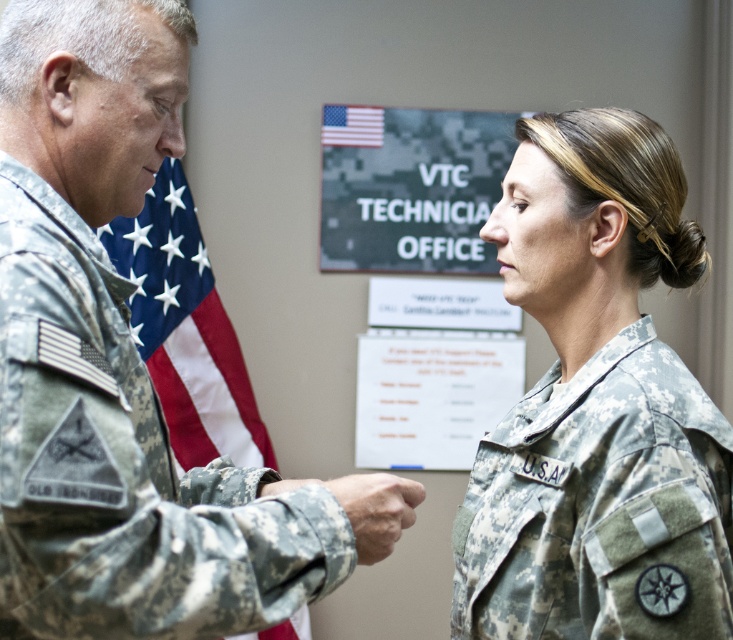
Between point (394, 125) and point (368, 332), which one is positioned in front?

Point (394, 125) is more forward.

Is camouflage fabric signboard at center positioned in front of white paper at center?

Yes, camouflage fabric signboard at center is closer to the viewer.

Who is more distant from viewer, (356, 253) or (408, 372)?

Point (408, 372)

Locate an element on the screen. The image size is (733, 640). camouflage fabric signboard at center is located at coordinates (410, 188).

From the picture: Is camouflage fabric uniform at right above white paper at center?

Indeed, camouflage fabric uniform at right is positioned over white paper at center.

Is the position of camouflage fabric uniform at right more distant than that of white paper at center?

That is False.

What do you see at coordinates (597, 406) in the screenshot? I see `camouflage fabric uniform at right` at bounding box center [597, 406].

Where is `camouflage fabric uniform at right`? The image size is (733, 640). camouflage fabric uniform at right is located at coordinates (597, 406).

Which is below, camouflage fabric uniform at right or camouflage fabric flag at center?

camouflage fabric uniform at right is below.

Does camouflage fabric uniform at right have a larger size compared to camouflage fabric flag at center?

No.

I want to click on camouflage fabric uniform at right, so click(597, 406).